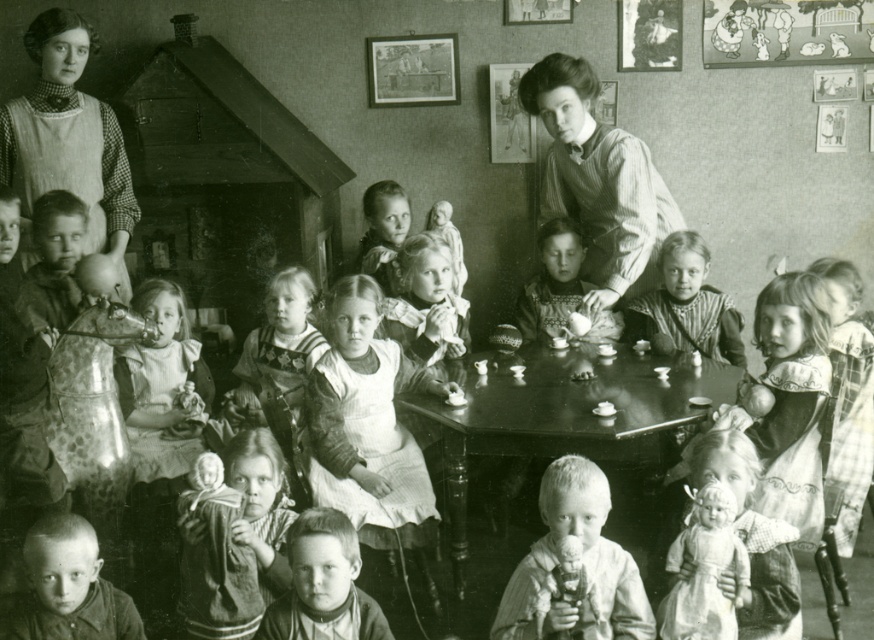
You are a photographer analyzing this historical image. The white cotton dress at center is positioned at coordinates 0.673 on the x and 0.423 on the y axis. If you want to place a virtual highlight on the dress, which object from the scene should you focus on based on its exact coordinates?

The white cotton dress at center is located at point (369, 429), so you should focus on the white cotton dress at center to place the virtual highlight accurately.

You are a photographer analyzing this historical image. You need to determine if the white cotton dress at center could potentially cover the entire metallic silver picture frame at upper center if placed directly over it. Based on the spatial relationship between these two items, what would you conclude?

The white cotton dress at center might be wider than metallic silver picture frame at upper center, so it could potentially cover the frame if placed directly over it.